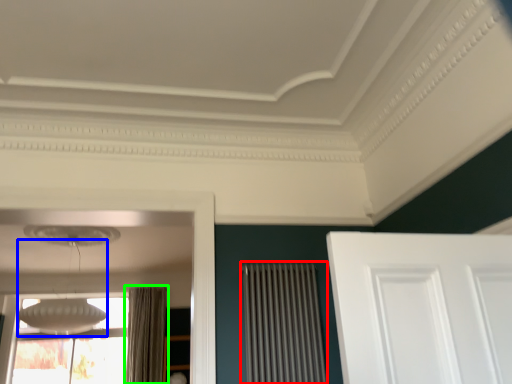
Question: Which object is positioned closest to radiator (highlighted by a red box)? Select from lamp (highlighted by a blue box) and curtain (highlighted by a green box).

Choices:
 (A) lamp
 (B) curtain

Answer: (A)